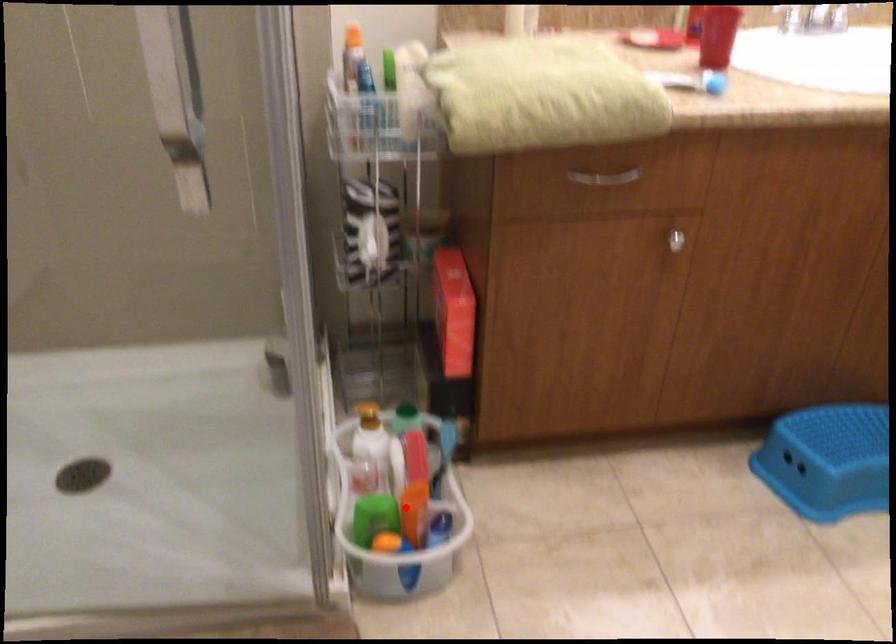
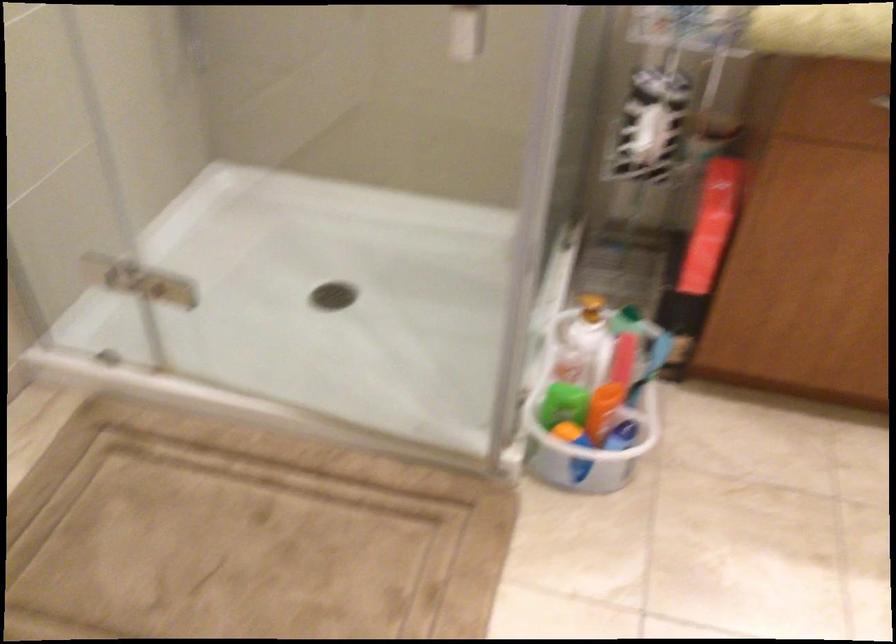
Find the pixel in the second image that matches the highlighted location in the first image.

(595, 397)